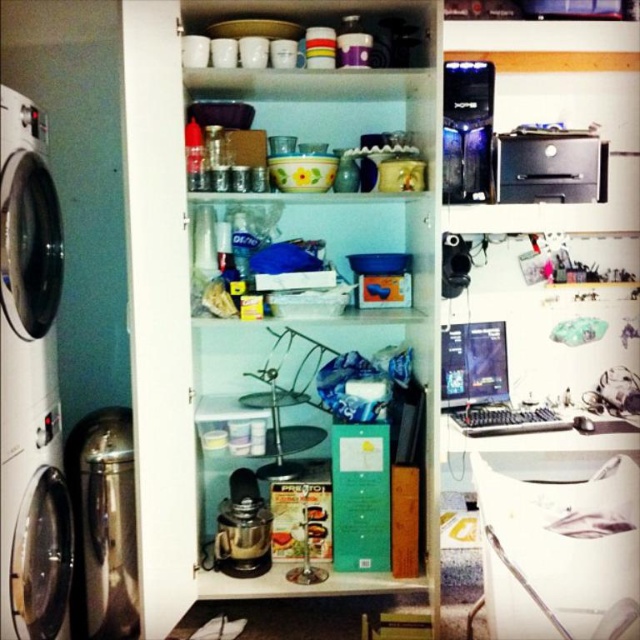
Can you confirm if white glossy washing machine at left is shorter than brushed metal dish washer at left?

No.

Consider the image. Measure the distance between white glossy washing machine at left and brushed metal dish washer at left.

They are 19.65 inches apart.

Does point (33, 284) come farther from viewer compared to point (65, 454)?

No.

Locate an element on the screen. This screenshot has width=640, height=640. white glossy washing machine at left is located at coordinates (28, 260).

Who is more distant from viewer, (317, 449) or (573, 145)?

The point (317, 449) is behind.

Can you confirm if matte plastic container at upper center is bigger than black plastic printer at upper right?

Indeed, matte plastic container at upper center has a larger size compared to black plastic printer at upper right.

Is point (218, 481) less distant than point (600, 182)?

No, it is behind (600, 182).

Identify the location of matte plastic container at upper center. This screenshot has height=640, width=640. (266, 288).

Consider the image. Can you confirm if matte plastic container at upper center is positioned below brushed metal dish washer at left?

Actually, matte plastic container at upper center is above brushed metal dish washer at left.

Between matte plastic container at upper center and brushed metal dish washer at left, which one is positioned higher?

matte plastic container at upper center is above.

Measure the distance between matte plastic container at upper center and camera.

matte plastic container at upper center is 5.61 feet from camera.

Where is `matte plastic container at upper center`? This screenshot has width=640, height=640. matte plastic container at upper center is located at coordinates (266, 288).